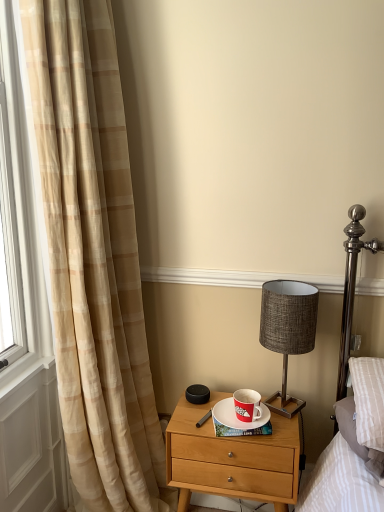
Find the location of `empty space that is ontop of white ceramic saucer at center (from a real-world perspective)`. empty space that is ontop of white ceramic saucer at center (from a real-world perspective) is located at coordinates (240, 410).